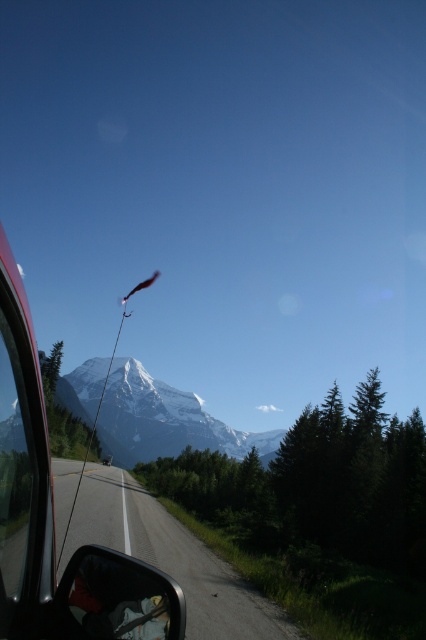
You are driving a car and see the point marked at coordinates (170, 557) in the image. Based on the scene description, where is this point located?

The point marked at coordinates (170, 557) is located on the asphalt road at center.

You are a passenger in the car and want to check the side mirror to see if there is a motorcycle behind you. Which object should you look at first, the metallic red car at left or the matte black side mirror at lower left?

You should look at the matte black side mirror at lower left first because the metallic red car at left is in front of it, blocking the view. The side mirror is positioned behind the car in the scene, so checking it directly would allow you to see the motorcycle behind.